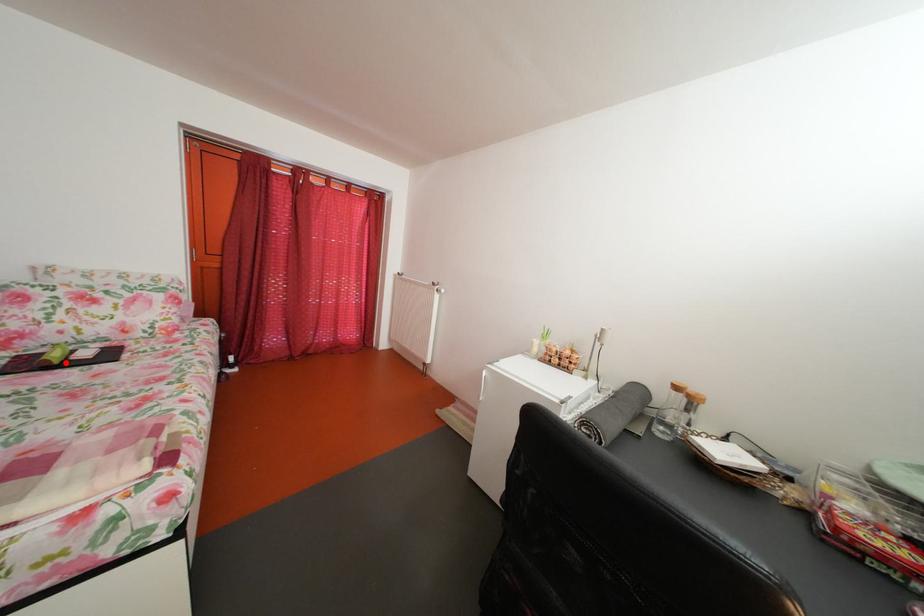
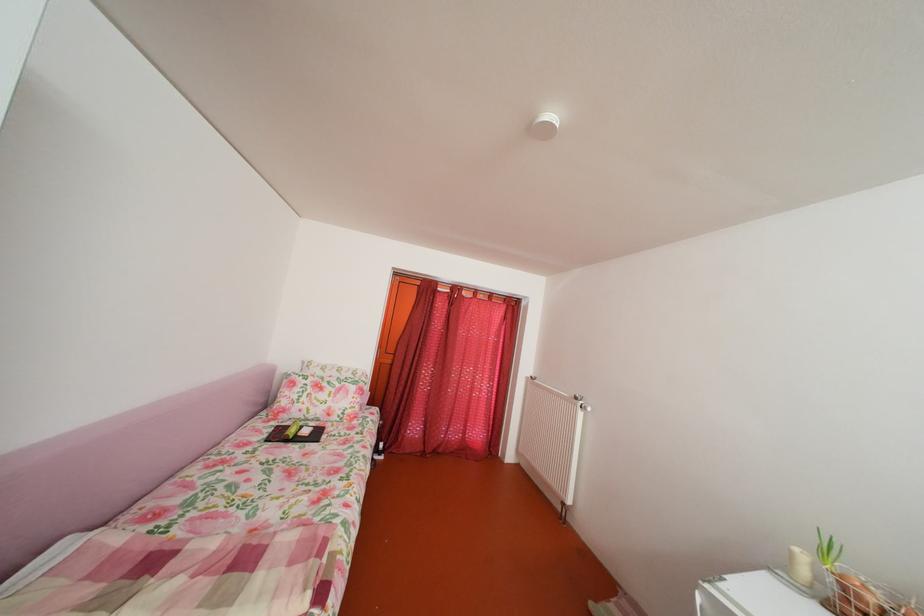
The point at the highlighted location is marked in the first image. Where is the corresponding point in the second image?

(304, 438)